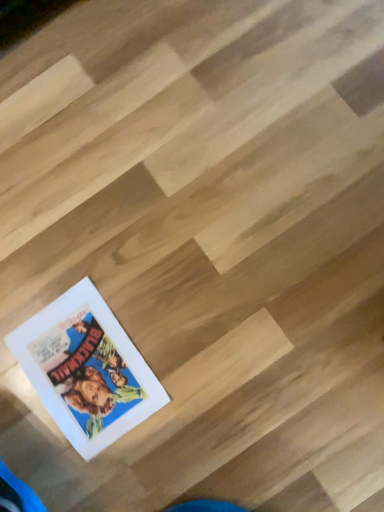
Where is `spots to the right of matte paper book at bottom left`? spots to the right of matte paper book at bottom left is located at coordinates (173, 305).